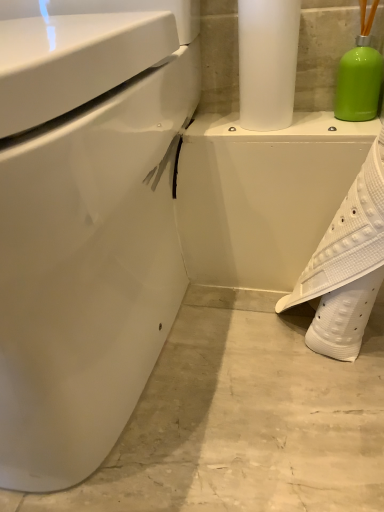
Question: Is satin white paper towel at upper center directly adjacent to white textured shoe at lower right?

Choices:
 (A) yes
 (B) no

Answer: (B)

Question: Does satin white paper towel at upper center have a lesser height compared to white textured shoe at lower right?

Choices:
 (A) yes
 (B) no

Answer: (A)

Question: From the image's perspective, is satin white paper towel at upper center under white textured shoe at lower right?

Choices:
 (A) yes
 (B) no

Answer: (B)

Question: From the image's perspective, is satin white paper towel at upper center over white textured shoe at lower right?

Choices:
 (A) yes
 (B) no

Answer: (A)

Question: Does satin white paper towel at upper center have a smaller size compared to white textured shoe at lower right?

Choices:
 (A) no
 (B) yes

Answer: (B)

Question: From a real-world perspective, is white glossy toilet at left positioned above or below satin white paper towel at upper center?

Choices:
 (A) below
 (B) above

Answer: (A)

Question: In terms of size, does white glossy toilet at left appear bigger or smaller than satin white paper towel at upper center?

Choices:
 (A) small
 (B) big

Answer: (B)

Question: Is white glossy toilet at left spatially inside satin white paper towel at upper center, or outside of it?

Choices:
 (A) outside
 (B) inside

Answer: (A)

Question: Does point (144, 250) appear closer or farther from the camera than point (258, 130)?

Choices:
 (A) farther
 (B) closer

Answer: (B)

Question: From a real-world perspective, is white glossy porcelain at center positioned above or below satin white paper towel at upper center?

Choices:
 (A) above
 (B) below

Answer: (B)

Question: Considering the positions of point (244, 248) and point (286, 20), is point (244, 248) closer or farther from the camera than point (286, 20)?

Choices:
 (A) farther
 (B) closer

Answer: (A)

Question: From the image's perspective, relative to satin white paper towel at upper center, is white glossy porcelain at center above or below?

Choices:
 (A) below
 (B) above

Answer: (A)

Question: From their relative heights in the image, would you say white glossy porcelain at center is taller or shorter than satin white paper towel at upper center?

Choices:
 (A) short
 (B) tall

Answer: (A)

Question: Looking at the image, does white textured shoe at lower right seem bigger or smaller compared to white glossy porcelain at center?

Choices:
 (A) small
 (B) big

Answer: (A)

Question: From the image's perspective, is white textured shoe at lower right located above or below white glossy porcelain at center?

Choices:
 (A) above
 (B) below

Answer: (B)